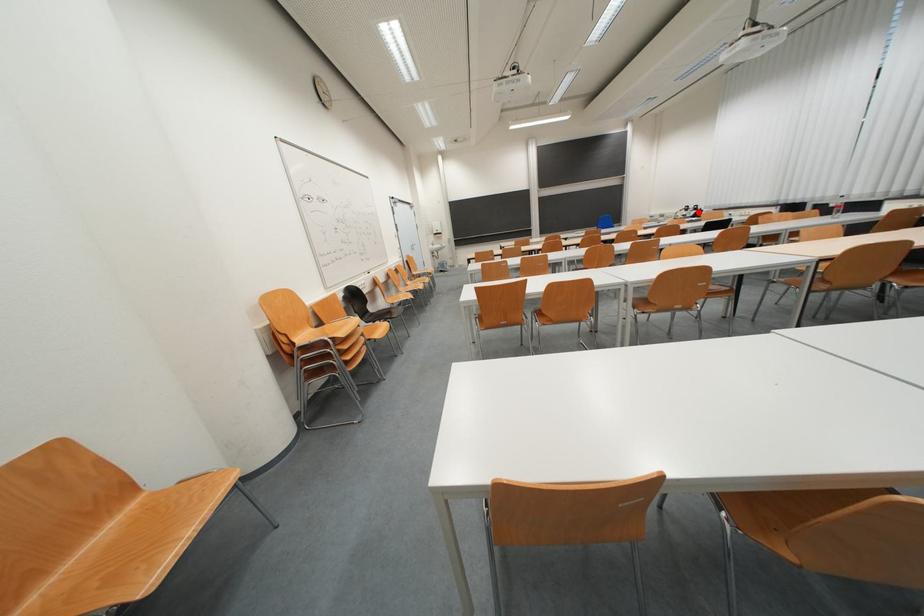
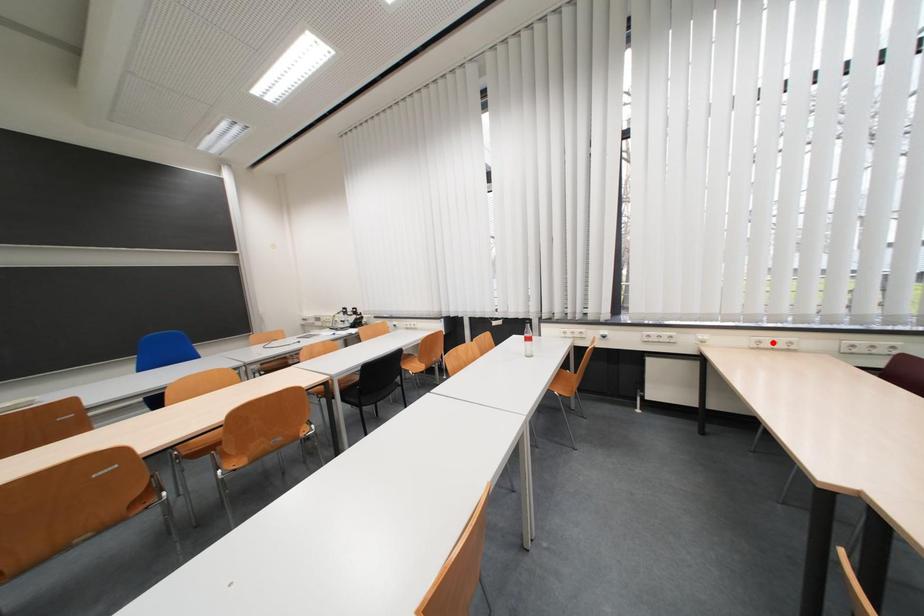
I am providing you with two images of the same scene from different viewpoints. A red point is marked on the first image and another point is marked on the second image. Is the marked point in image1 the same physical position as the marked point in image2?

No